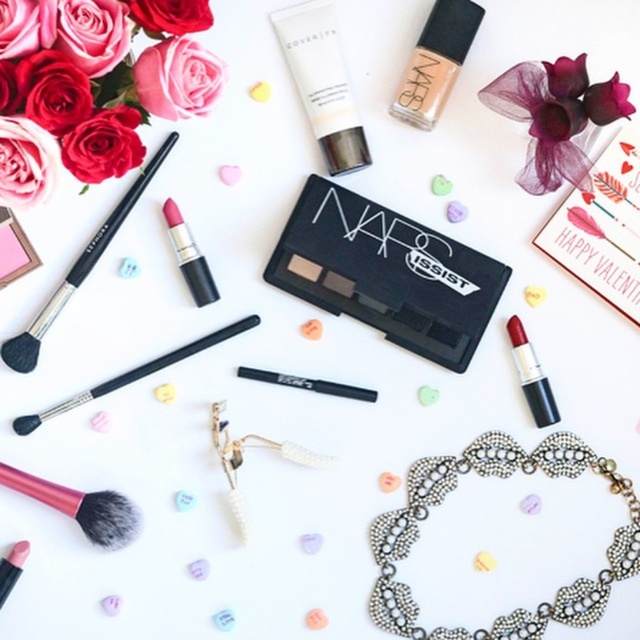
You are standing 3 feet away from the bouquet of roses in shades of pink and red in the upper left corner. There is a point at coordinates point [81,492]. Can you reach that point without moving closer than 3 feet to the bouquet of roses in shades of pink and red in the upper left corner?

The distance of point [81,492] from viewer is 3.41 feet, so yes, you can reach that point without moving closer than 3 feet to the bouquet of roses in shades of pink and red in the upper left corner because the point is 0.41 feet farther away than your current position.

You are organizing a makeup kit and need to place the pink synthetic hair brush at lower left and the matte pink lipstick at center. Based on their positions in the image, which item is located to the right side of the other?

The matte pink lipstick at center is to the right of the pink synthetic hair brush at lower left.